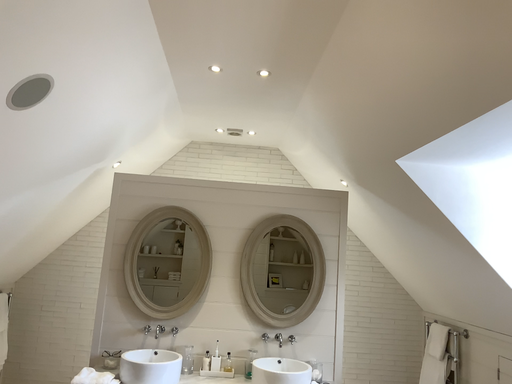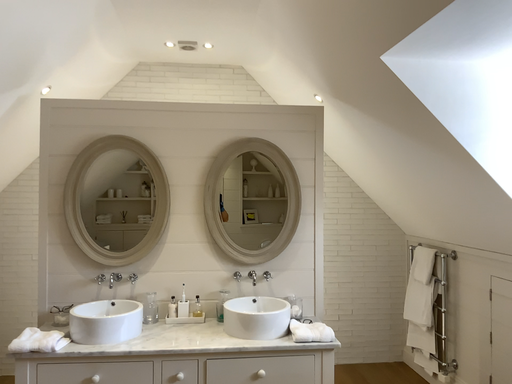
Question: How did the camera likely rotate when shooting the video?

Choices:
 (A) rotated downward
 (B) rotated upward

Answer: (A)